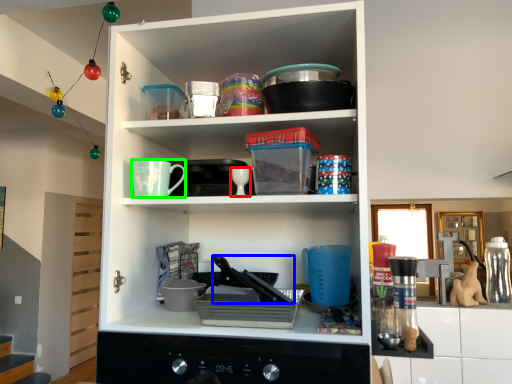
Question: Which object is positioned farthest from tableware (highlighted by a red box)? Select from appliance (highlighted by a blue box) and mug (highlighted by a green box).

Choices:
 (A) appliance
 (B) mug

Answer: (A)